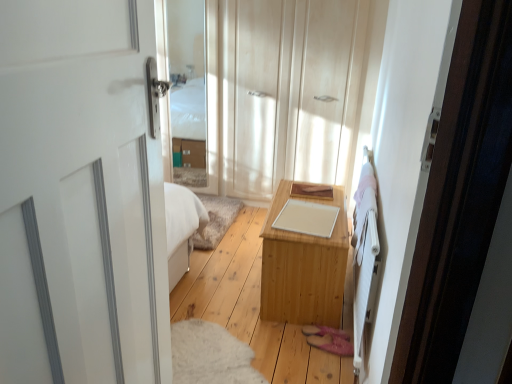
The width and height of the screenshot is (512, 384). What are the coordinates of `white wooden bed frame at right` in the screenshot? It's located at click(x=364, y=254).

What do you see at coordinates (303, 268) in the screenshot? I see `light wood table at center` at bounding box center [303, 268].

What is the approximate height of light wood dresser at center?

light wood dresser at center is 1.56 meters in height.

Identify the location of white wooden bed frame at right. Image resolution: width=512 pixels, height=384 pixels. (364, 254).

Who is shorter, light wood dresser at center or clear glass mirror at upper center?

Standing shorter between the two is clear glass mirror at upper center.

Find the location of a particular element. Image resolution: width=512 pixels, height=384 pixels. dresser in front of the clear glass mirror at upper center is located at coordinates (292, 92).

In the scene shown: Is light wood dresser at center outside of clear glass mirror at upper center?

Indeed, light wood dresser at center is completely outside clear glass mirror at upper center.

Based on their sizes in the image, would you say light wood dresser at center is bigger or smaller than clear glass mirror at upper center?

In the image, light wood dresser at center appears to be larger than clear glass mirror at upper center.

Considering their positions, is light wood dresser at center located in front of or behind white wooden bed frame at right?

Visually, light wood dresser at center is located behind white wooden bed frame at right.

How different are the orientations of light wood dresser at center and white wooden bed frame at right in degrees?

The angle between the facing direction of light wood dresser at center and the facing direction of white wooden bed frame at right is 89.1 degrees.

Considering the relative sizes of light wood dresser at center and white wooden bed frame at right in the image provided, is light wood dresser at center thinner than white wooden bed frame at right?

Indeed, light wood dresser at center has a lesser width compared to white wooden bed frame at right.

From a real-world perspective, between light wood dresser at center and white wooden bed frame at right, who is vertically higher?

light wood dresser at center, from a real-world perspective.

Considering the relative sizes of white glossy door at left and light wood dresser at center in the image provided, is white glossy door at left bigger than light wood dresser at center?

Indeed, white glossy door at left has a larger size compared to light wood dresser at center.

Is white glossy door at left beside light wood dresser at center?

white glossy door at left and light wood dresser at center are not in contact.

Does white glossy door at left have a lesser width compared to light wood dresser at center?

No, white glossy door at left is not thinner than light wood dresser at center.

Between white glossy door at left and light wood table at center, which one appears on the left side from the viewer's perspective?

Positioned to the left is white glossy door at left.

Is white glossy door at left placed right next to light wood table at center?

white glossy door at left and light wood table at center are not in contact.

From the image's perspective, between white glossy door at left and light wood table at center, who is located below?

light wood table at center is shown below in the image.

In terms of width, does white glossy door at left look wider or thinner when compared to light wood table at center?

white glossy door at left is thinner than light wood table at center.

Is white glossy door at left inside the boundaries of clear glass mirror at upper center, or outside?

white glossy door at left is not inside clear glass mirror at upper center, it's outside.

From the image's perspective, does white glossy door at left appear higher than clear glass mirror at upper center?

Actually, white glossy door at left appears below clear glass mirror at upper center in the image.

Is white glossy door at left far from clear glass mirror at upper center?

Yes.

Which is closer to the camera, (13, 48) or (210, 164)?

Positioned in front is point (13, 48).

Who is taller, light wood dresser at center or light wood table at center?

Standing taller between the two is light wood dresser at center.

Between light wood dresser at center and light wood table at center, which one has larger width?

light wood table at center is wider.

From the image's perspective, is light wood dresser at center over light wood table at center?

Correct, light wood dresser at center appears higher than light wood table at center in the image.

Which point is more forward, (336, 316) or (124, 148)?

The point (124, 148) is in front.

Based on the photo, how far apart are light wood table at center and white glossy door at left?

They are 3.71 feet apart.

From the image's perspective, between light wood table at center and white glossy door at left, which one is located above?

white glossy door at left, from the image's perspective.

Who is taller, light wood table at center or white glossy door at left?

white glossy door at left.

At what (x,y) coordinates should I click in order to perform the action: click on dresser on the right of clear glass mirror at upper center. Please return your answer as a coordinate pair (x, y). Looking at the image, I should click on (292, 92).

Locate an element on the screen. The image size is (512, 384). dresser on the left of white wooden bed frame at right is located at coordinates pos(292,92).

Looking at the image, which one is located further to white glossy door at left, clear glass mirror at upper center or white wooden bed frame at right?

clear glass mirror at upper center is positioned further to the anchor white glossy door at left.

Which object lies nearer to the anchor point light wood table at center, white wooden bed frame at right or white glossy door at left?

white wooden bed frame at right lies closer to light wood table at center than the other object.

Which object lies further to the anchor point light wood dresser at center, white wooden bed frame at right or light wood table at center?

Based on the image, white wooden bed frame at right appears to be further to light wood dresser at center.

Estimate the real-world distances between objects in this image. Which object is closer to light wood table at center, white glossy door at left or light wood dresser at center?

light wood dresser at center lies closer to light wood table at center than the other object.

When comparing their distances from clear glass mirror at upper center, does white glossy door at left or white wooden bed frame at right seem further?

Among the two, white glossy door at left is located further to clear glass mirror at upper center.

Looking at the image, which one is located closer to light wood table at center, clear glass mirror at upper center or light wood dresser at center?

The object closer to light wood table at center is light wood dresser at center.

Looking at this image, estimate the real-world distances between objects in this image. Which object is closer to light wood table at center, clear glass mirror at upper center or white glossy door at left?

white glossy door at left lies closer to light wood table at center than the other object.

Looking at the image, which one is located further to light wood dresser at center, white wooden bed frame at right or clear glass mirror at upper center?

Based on the image, white wooden bed frame at right appears to be further to light wood dresser at center.

Find the location of a particular element. The height and width of the screenshot is (384, 512). bed frame located between white glossy door at left and light wood table at center in the depth direction is located at coordinates (364, 254).

The width and height of the screenshot is (512, 384). I want to click on bed frame between white glossy door at left and light wood dresser at center from front to back, so click(364, 254).

I want to click on dresser between clear glass mirror at upper center and light wood table at center in the up-down direction, so click(x=292, y=92).

At what (x,y) coordinates should I click in order to perform the action: click on bed frame positioned between white glossy door at left and clear glass mirror at upper center from near to far. Please return your answer as a coordinate pair (x, y). The height and width of the screenshot is (384, 512). Looking at the image, I should click on (364, 254).